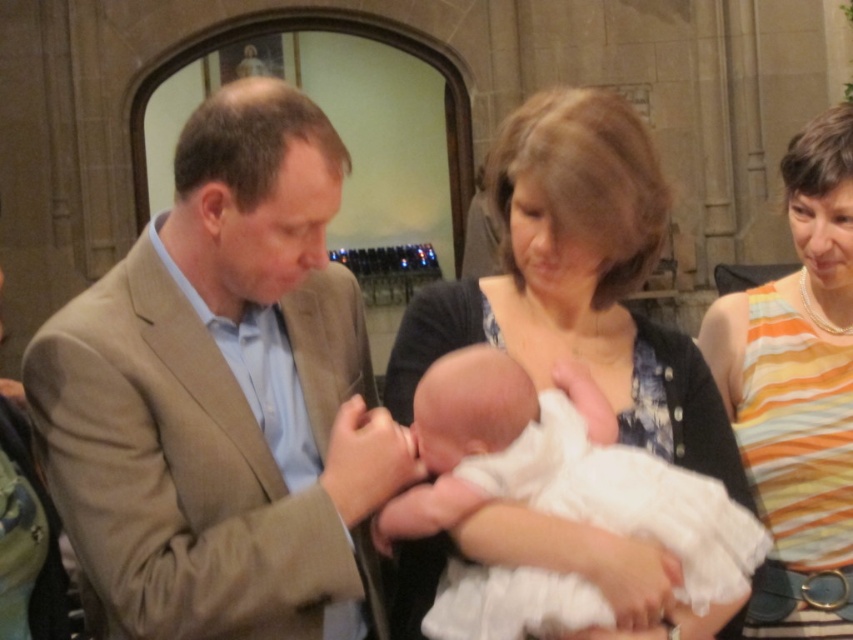
You are a photographer preparing to take a photo of the orange striped tank top at right and the white clothed newborn at center. Which object should you focus on first if you want to capture both in sharp focus, considering their sizes?

The orange striped tank top at right is thinner than the white clothed newborn at center, so you should focus on the orange striped tank top at right first since smaller objects are easier to keep in focus when adjusting the camera settings.

You are a photographer at the back of the room. You want to take a photo of the light brown suit at center and the white clothed newborn at center. According to the scene description, which object is positioned lower in the frame?

The light brown suit at center is positioned below the white clothed newborn at center, so it is lower in the frame.